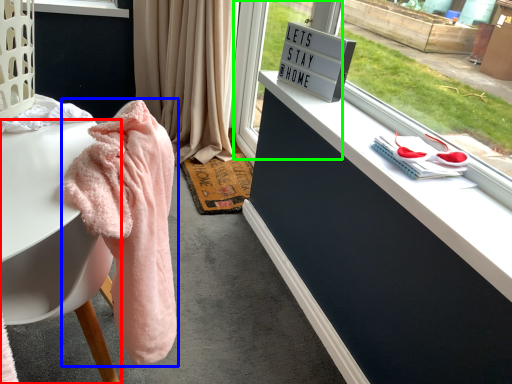
Question: Which object is positioned closest to desk (highlighted by a red box)? Select from bath towel (highlighted by a blue box) and glass door (highlighted by a green box).

Choices:
 (A) bath towel
 (B) glass door

Answer: (A)